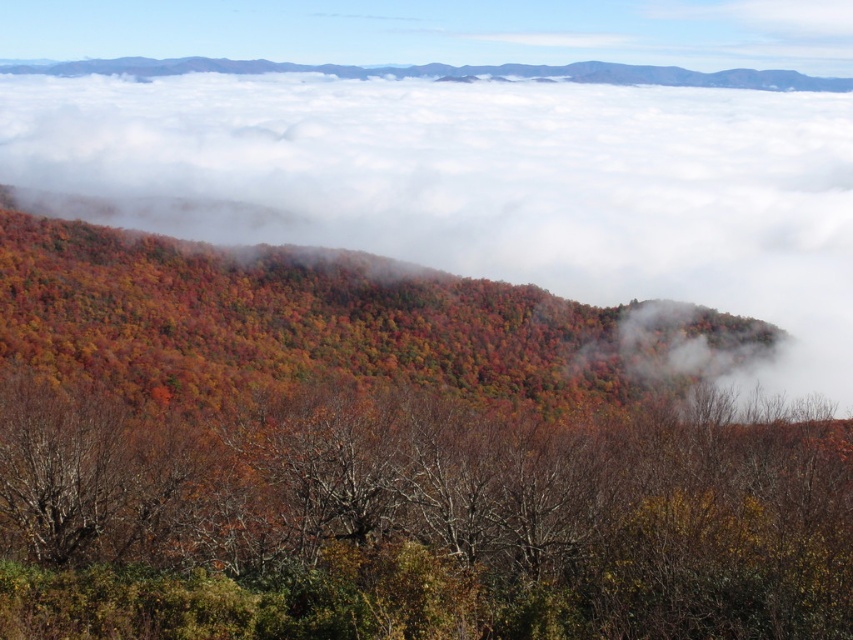
You are standing in the middle of the autumn landscape and want to locate the brown matte tree at center. According to the coordinates provided, where would you look relative to your position?

The brown matte tree at center is located at coordinates point (421, 522), which means it is positioned slightly to the right and slightly above your current viewpoint.

Looking at this image, you are an artist planning to paint the landscape scene. You want to ensure that the brown matte tree at center and the white fluffy cloud at upper center are proportionally accurate. Which object should you make smaller in your painting to maintain the correct proportions?

The brown matte tree at center should be made smaller because it occupies less space than the white fluffy cloud at upper center according to the description.

Looking at this image, you are an artist planning to paint the landscape. You want to ensure the brown matte tree at center and the white fluffy cloud at upper center are proportionate to their actual sizes. Which object should you draw smaller in your painting?

The brown matte tree at center should be drawn smaller than the white fluffy cloud at upper center because the brown matte tree at center is shorter than the white fluffy cloud at upper center.